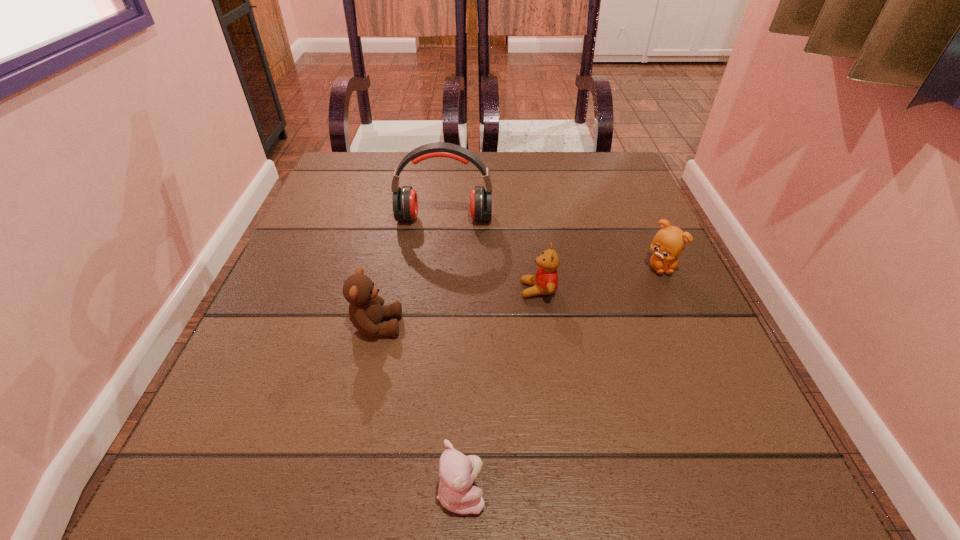
Identify the location of the tallest object. (405, 203).

In order to click on the farthest object in this screenshot , I will do click(405, 203).

This screenshot has width=960, height=540. I want to click on the third farthest teddy bear, so click(x=366, y=311).

Image resolution: width=960 pixels, height=540 pixels. What are the coordinates of `the leftmost teddy bear` in the screenshot? It's located at (366, 311).

At what (x,y) coordinates should I click in order to perform the action: click on the rightmost teddy bear. Please return your answer as a coordinate pair (x, y). The height and width of the screenshot is (540, 960). Looking at the image, I should click on (669, 242).

The width and height of the screenshot is (960, 540). Identify the location of the second teddy bear from right to left. (545, 282).

The width and height of the screenshot is (960, 540). In order to click on the nearest teddy bear in this screenshot , I will do `click(457, 472)`.

At what (x,y) coordinates should I click in order to perform the action: click on the third teddy bear from right to left. Please return your answer as a coordinate pair (x, y). The image size is (960, 540). Looking at the image, I should click on (457, 472).

You are a GUI agent. You are given a task and a screenshot of the screen. Output one action in this format:
    pyautogui.click(x=<x>, y=<y>)
    Task: Click on the free spot located 0.050m on the ear cups of the earphone
    This screenshot has width=960, height=540.
    Given the screenshot: What is the action you would take?
    pyautogui.click(x=442, y=242)

Locate an element on the screen. vacant space located on the face of the leftmost teddy bear is located at coordinates (489, 326).